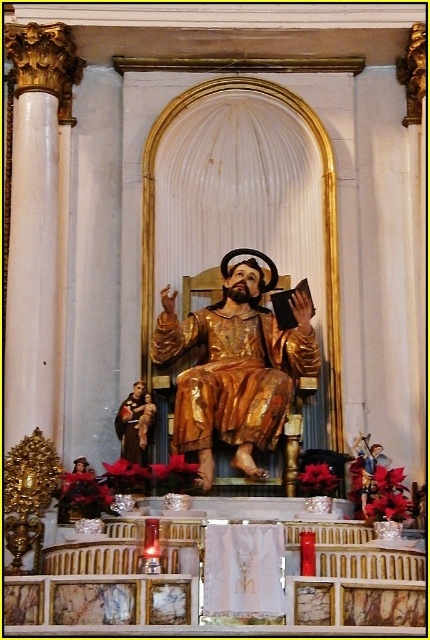
Question: Among these objects, which one is nearest to the camera?

Choices:
 (A) golden statue at center
 (B) matte gold statue at center
 (C) gold polished statue at center
 (D) gold statue at center

Answer: (C)

Question: Does gold statue at center come behind golden statue at center?

Choices:
 (A) no
 (B) yes

Answer: (B)

Question: Is gold polished statue at center above gold statue at center?

Choices:
 (A) no
 (B) yes

Answer: (B)

Question: Is the position of matte gold statue at center less distant than that of golden statue at center?

Choices:
 (A) yes
 (B) no

Answer: (B)

Question: Which point appears farthest from the camera in this image?

Choices:
 (A) (137, 412)
 (B) (147, 440)
 (C) (365, 474)

Answer: (B)

Question: Which point is farther to the camera?

Choices:
 (A) (137, 396)
 (B) (149, 422)
 (C) (175, 339)
 (D) (368, 454)

Answer: (C)